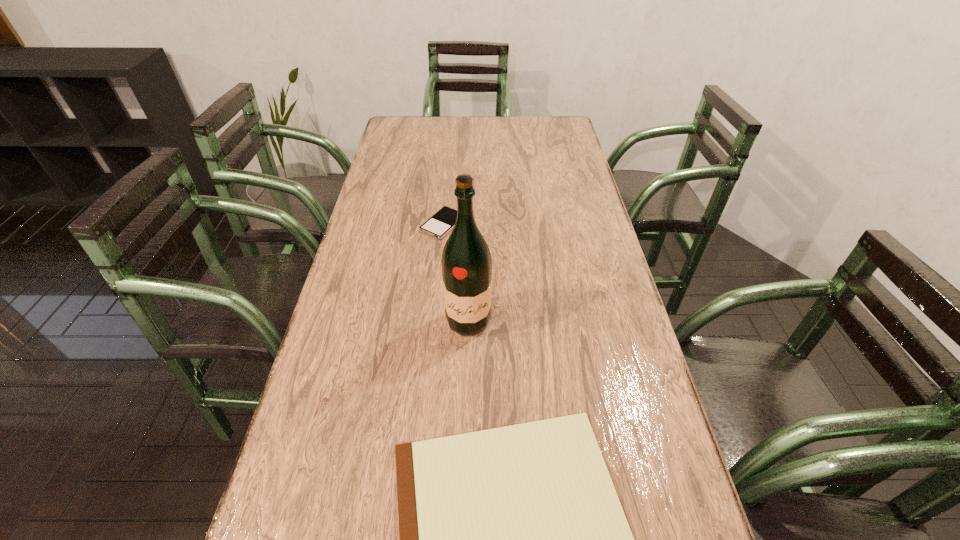
You are a GUI agent. You are given a task and a screenshot of the screen. Output one action in this format:
    pyautogui.click(x=<x>, y=<y>)
    Task: Click on the object identified as the second closest to the iPod
    
    Given the screenshot: What is the action you would take?
    pyautogui.click(x=513, y=539)